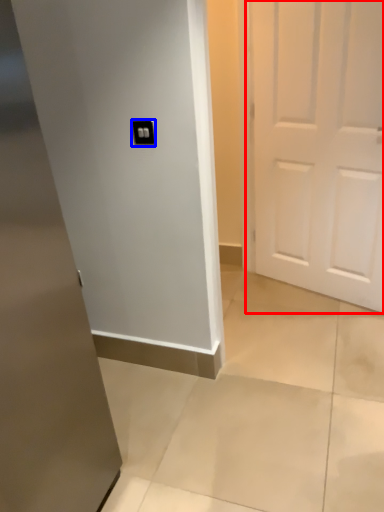
Question: Which object is further to the camera taking this photo, door (highlighted by a red box) or light switch (highlighted by a blue box)?

Choices:
 (A) door
 (B) light switch

Answer: (A)